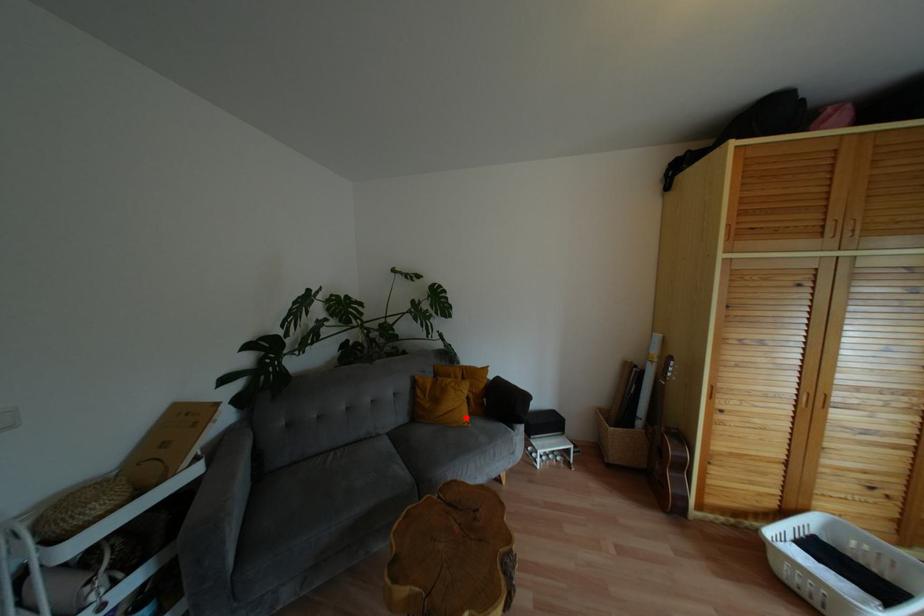
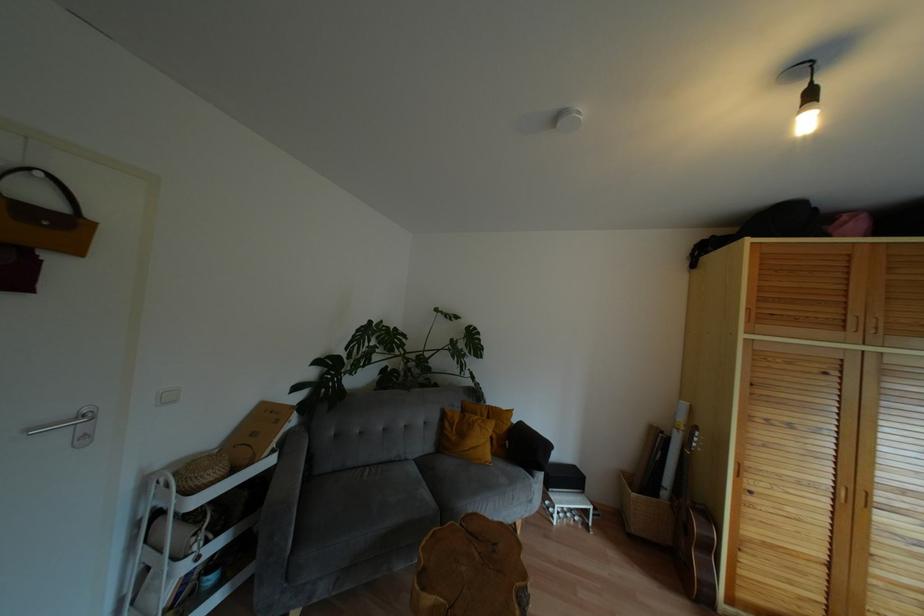
The point at the highlighted location is marked in the first image. Where is the corresponding point in the second image?

(488, 456)